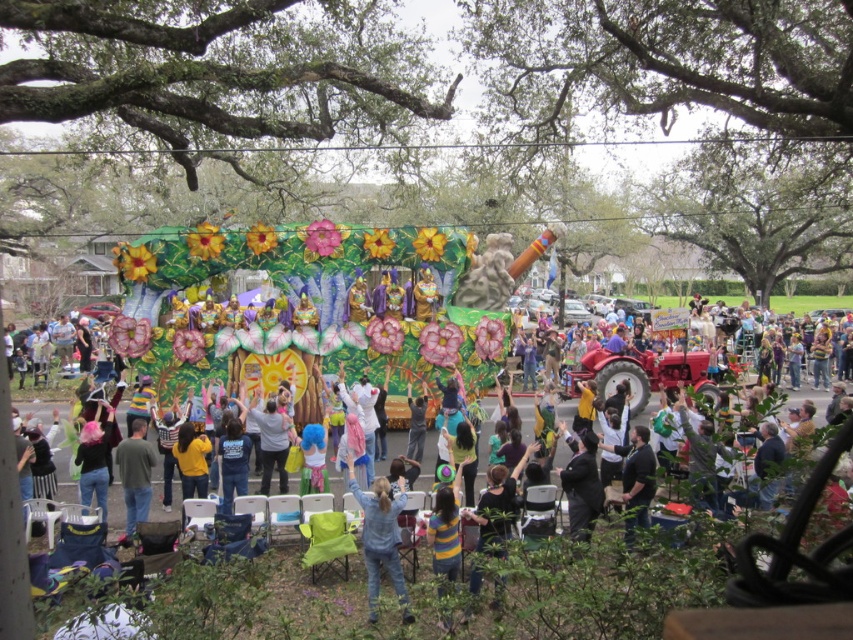
You are a photographer at the parade and want to take a photo that includes both the denim jacket at center and the gray cotton shirt at lower left. However, you can only focus on one of them clearly. Which one should you focus on to ensure it appears larger in the photo?

The denim jacket at center is much taller than the gray cotton shirt at lower left, so focusing on the denim jacket at center will make it appear larger in the photo.

You are a photographer trying to capture a photo of the denim jacket at center and the gray cotton shirt at lower left. The camera has a limited focus range. Which object should you focus on first to ensure both are in the frame?

The denim jacket at center is wider than the gray cotton shirt at lower left, so you should focus on the denim jacket at center first to ensure both are in the frame.

You are a photographer at the parade and want to capture both the denim jacket at center and the gray cotton shirt at lower left in a single shot. Can you position yourself so that both are fully visible without any obstruction?

The denim jacket at center is in front of the gray cotton shirt at lower left, so if you position yourself behind the gray cotton shirt at lower left, both will be visible with the denim jacket at center in the foreground and the gray cotton shirt at lower left in the background.